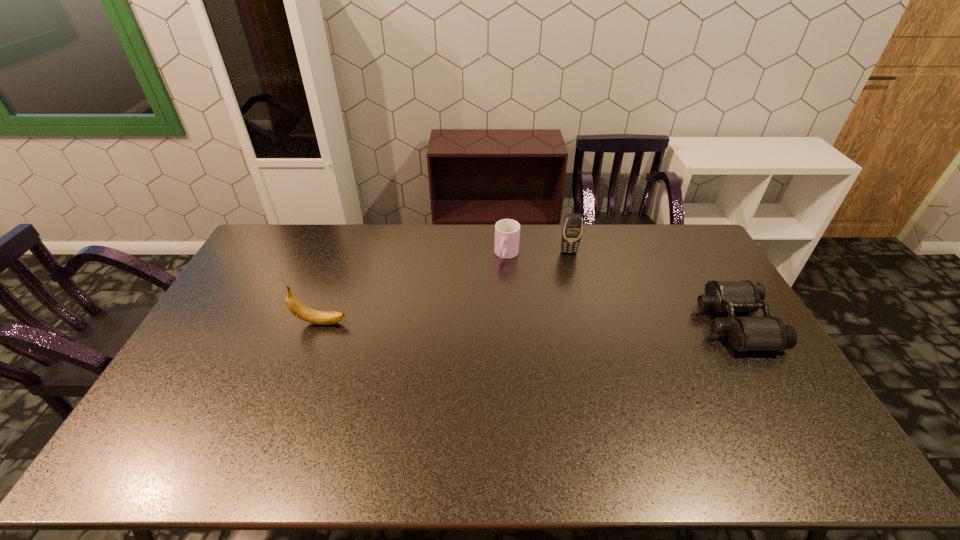
Find the location of a particular element. This screenshot has width=960, height=540. free region at the near edge of the desktop is located at coordinates point(534,426).

I want to click on vacant space at the left edge, so click(236, 326).

Identify the location of vacant region at the right edge of the desktop. The height and width of the screenshot is (540, 960). [x=707, y=333].

The width and height of the screenshot is (960, 540). In the image, there is a desktop. Identify the location of vacant space at the far left corner. (266, 247).

I want to click on free space at the far right corner of the desktop, so click(x=660, y=232).

What are the coordinates of `vacant space in between the second object from left to right and the binoculars` in the screenshot? It's located at (621, 289).

Locate an element on the screen. The height and width of the screenshot is (540, 960). vacant space that is in between the third object from right to left and the shortest object is located at coordinates (621, 289).

You are a GUI agent. You are given a task and a screenshot of the screen. Output one action in this format:
    pyautogui.click(x=<x>, y=<y>)
    Task: Click on the empty space between the rightmost object and the banana
    
    Given the screenshot: What is the action you would take?
    pyautogui.click(x=528, y=323)

The image size is (960, 540). Identify the location of free space between the banana and the cup. (414, 289).

At what (x,y) coordinates should I click in order to perform the action: click on vacant area that lies between the cellular telephone and the shortest object. Please return your answer as a coordinate pair (x, y). This screenshot has width=960, height=540. Looking at the image, I should click on (652, 288).